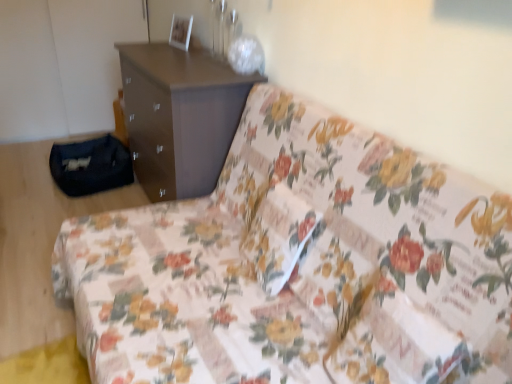
Question: From the image's perspective, is floral fabric pillow at center positioned above or below brown matte chest of drawers at upper center?

Choices:
 (A) above
 (B) below

Answer: (B)

Question: Considering the positions of floral fabric pillow at center and brown matte chest of drawers at upper center in the image, is floral fabric pillow at center wider or thinner than brown matte chest of drawers at upper center?

Choices:
 (A) wide
 (B) thin

Answer: (B)

Question: Considering the real-world distances, which object is closest to the floral fabric couch at center?

Choices:
 (A) floral fabric pillow at center
 (B) brown matte chest of drawers at upper center

Answer: (A)

Question: Estimate the real-world distances between objects in this image. Which object is closer to the floral fabric pillow at center?

Choices:
 (A) brown matte chest of drawers at upper center
 (B) floral fabric couch at center

Answer: (B)